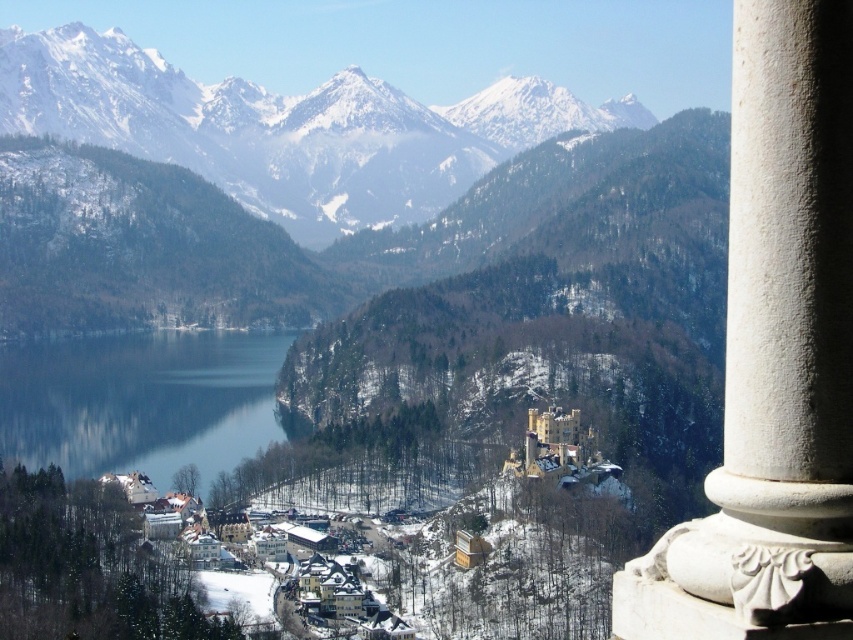
Question: Which object is closer to the camera taking this photo?

Choices:
 (A) blue glass water at center
 (B) white stone column at right
 (C) snowy granite mountains at upper left

Answer: (B)

Question: Considering the real-world distances, which object is closest to the snowy granite mountains at upper left?

Choices:
 (A) white stone column at right
 (B) blue glass water at center

Answer: (B)

Question: Does snowy granite mountains at upper left appear on the left side of blue glass water at center?

Choices:
 (A) yes
 (B) no

Answer: (B)

Question: Which object appears closest to the camera in this image?

Choices:
 (A) white stone column at right
 (B) snowy granite mountains at upper left

Answer: (A)

Question: Can you confirm if snowy granite mountains at upper left is positioned above blue glass water at center?

Choices:
 (A) yes
 (B) no

Answer: (A)

Question: Can you confirm if snowy granite mountains at upper left is smaller than blue glass water at center?

Choices:
 (A) no
 (B) yes

Answer: (A)